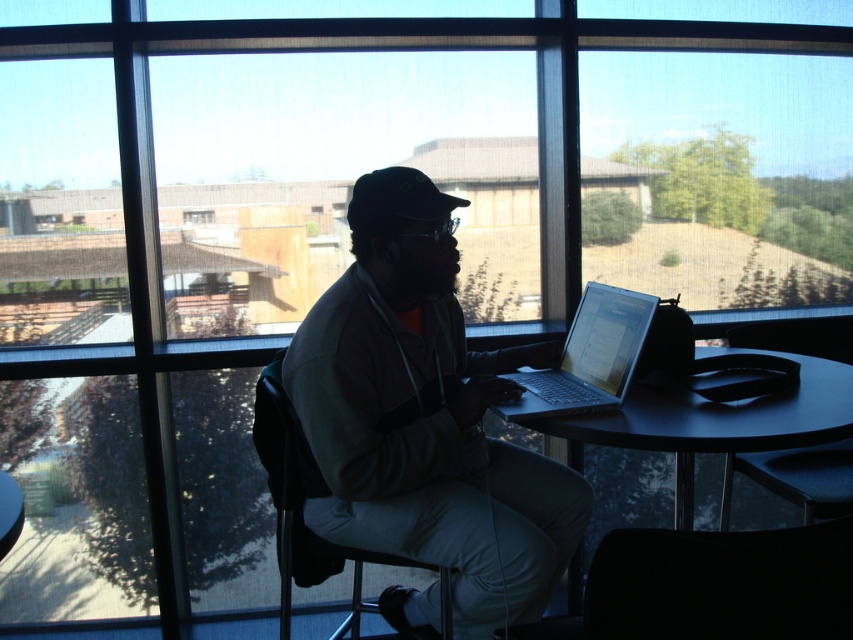
You are a delivery person who needs to place a small package on the table. The package measures 7 inches in length. Can you place it between the black plastic table at center and the silver metallic laptop at center without moving either object?

The distance between the black plastic table at center and the silver metallic laptop at center is 6.59 inches. Since the package is 7 inches long, it cannot fit in the available space without moving either object.

You are trying to place a new keyboard on the table. The keyboard requires 20 cm of space in front of the silver metallic laptop at center. Is there enough space on the black plastic table at center for this?

The black plastic table at center is in front of the silver metallic laptop at center, but the description does not provide specific measurements about the available space. Therefore, it is unclear if there is enough space for the keyboard.